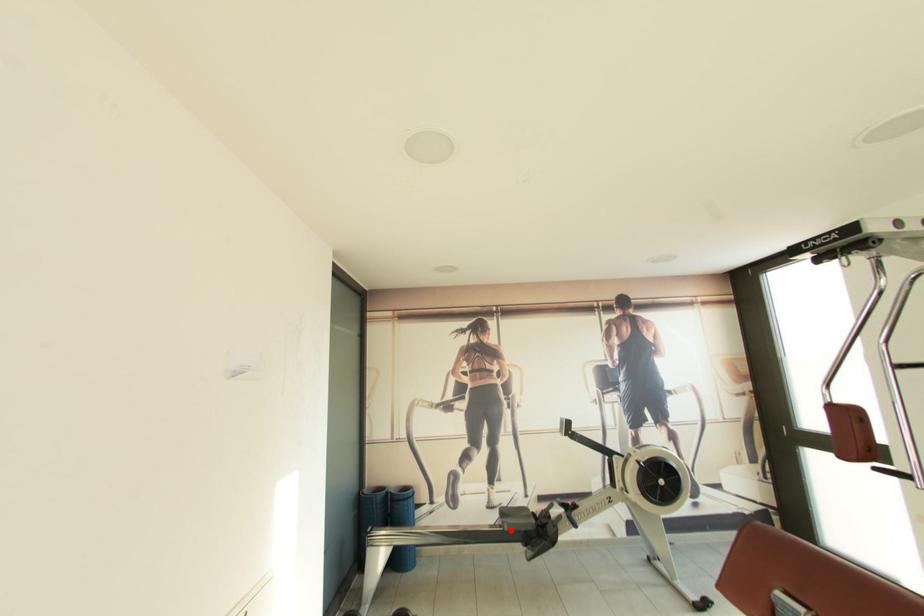
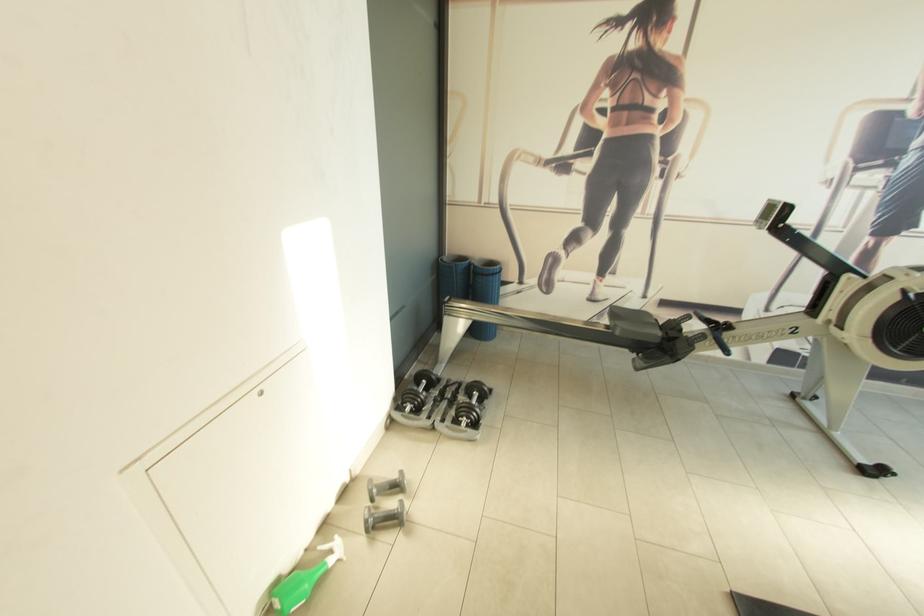
The point at the highlighted location is marked in the first image. Where is the corresponding point in the second image?

(622, 334)